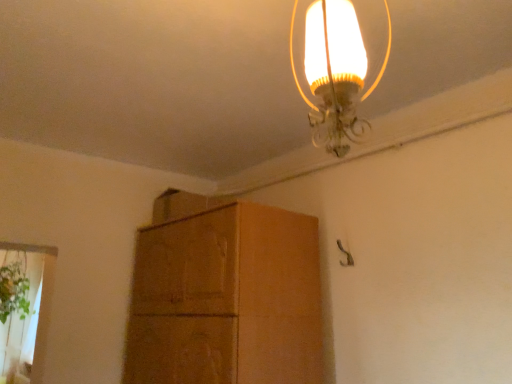
Question: Is point (293, 13) positioned closer to the camera than point (17, 279)?

Choices:
 (A) closer
 (B) farther

Answer: (A)

Question: In the image, is translucent glass lampshade at upper center positioned in front of or behind green leafy plant at lower left?

Choices:
 (A) front
 (B) behind

Answer: (A)

Question: Which object is positioned closest to the brown cardboard cabinet at center?

Choices:
 (A) translucent glass lampshade at upper center
 (B) green leafy plant at lower left

Answer: (B)

Question: Which of these objects is positioned farthest from the translucent glass lampshade at upper center?

Choices:
 (A) brown cardboard cabinet at center
 (B) green leafy plant at lower left

Answer: (B)